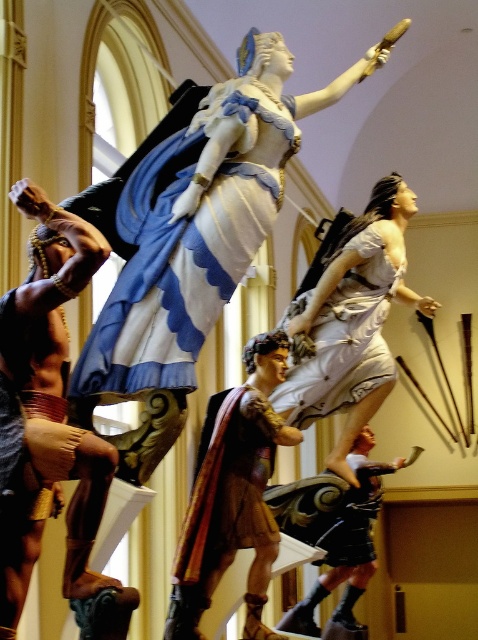
Between polished bronze warrior at center and velvet-like fabric cape at center, which one appears on the right side from the viewer's perspective?

Positioned to the right is polished bronze warrior at center.

Who is more forward, (322, 637) or (352, 490)?

Positioned in front is point (352, 490).

Locate an element on the screen. polished bronze warrior at center is located at coordinates (334, 538).

Describe the element at coordinates (45, 305) in the screenshot. I see `wooden figure at left` at that location.

Is the position of wooden figure at left more distant than that of velvet-like fabric cape at center?

No, wooden figure at left is closer to the viewer.

The height and width of the screenshot is (640, 478). What do you see at coordinates (45, 305) in the screenshot?
I see `wooden figure at left` at bounding box center [45, 305].

Where is `wooden figure at left`? This screenshot has width=478, height=640. wooden figure at left is located at coordinates (45, 305).

Is point (352, 244) positioned before point (302, 392)?

No, it is behind (302, 392).

Which is behind, point (388, 260) or point (306, 401)?

The point (388, 260) is more distant.

Describe the element at coordinates (349, 323) in the screenshot. I see `white fabric dress at center` at that location.

This screenshot has height=640, width=478. In order to click on white fabric dress at center in this screenshot , I will do `click(349, 323)`.